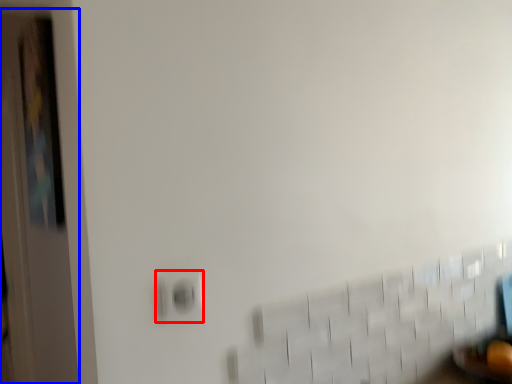
Question: Among these objects, which one is nearest to the camera, electric outlet (highlighted by a red box) or door (highlighted by a blue box)?

Choices:
 (A) electric outlet
 (B) door

Answer: (A)